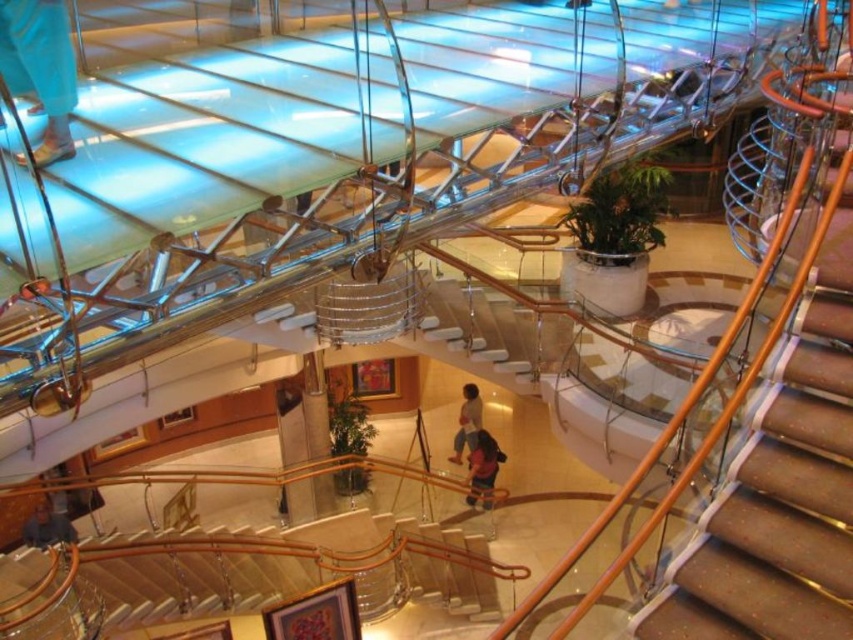
Between wooden stairs at center and blue denim jeans at lower left, which one is positioned higher?

Positioned higher is wooden stairs at center.

What do you see at coordinates (244, 573) in the screenshot? This screenshot has height=640, width=853. I see `wooden stairs at center` at bounding box center [244, 573].

Where is `wooden stairs at center`? The image size is (853, 640). wooden stairs at center is located at coordinates (244, 573).

Who is positioned more to the right, matte blue jeans at upper left or dark blue shirt at center?

dark blue shirt at center is more to the right.

Is point (30, 28) positioned before point (490, 456)?

Yes, it is in front of point (490, 456).

The image size is (853, 640). In order to click on matte blue jeans at upper left in this screenshot , I will do `click(39, 67)`.

Does point (42, 29) come in front of point (67, 541)?

That is True.

At what (x,y) coordinates should I click in order to perform the action: click on matte blue jeans at upper left. Please return your answer as a coordinate pair (x, y). Looking at the image, I should click on (39, 67).